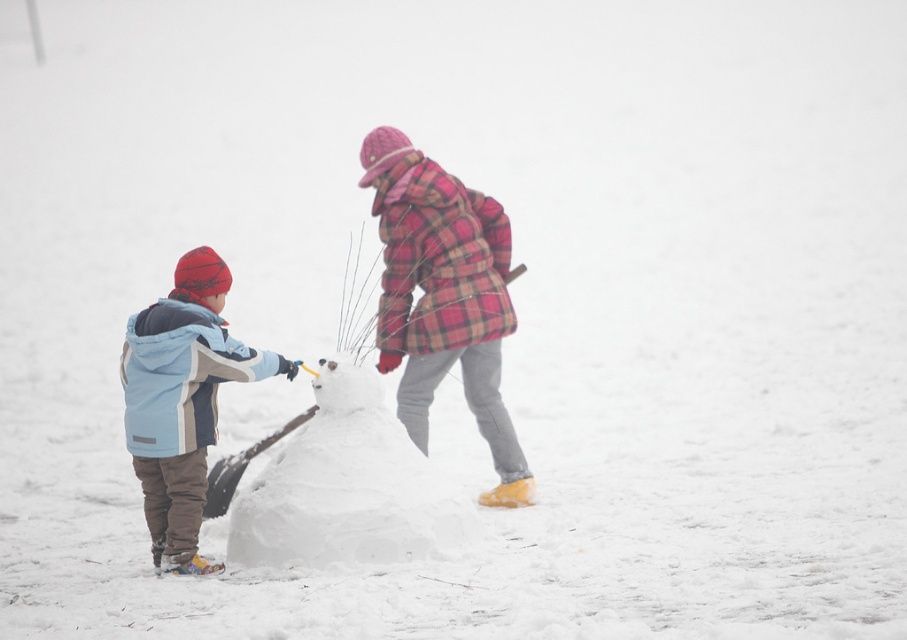
Question: Which object is positioned closest to the plaid fabric coat at center?

Choices:
 (A) light blue fleece jacket at left
 (B) white fluffy snowman at center

Answer: (B)

Question: Which point is closer to the camera?

Choices:
 (A) plaid fabric coat at center
 (B) light blue fleece jacket at left

Answer: (B)

Question: Can you confirm if white fluffy snowman at center is bigger than light blue fleece jacket at left?

Choices:
 (A) no
 (B) yes

Answer: (B)

Question: Can you confirm if white fluffy snowman at center is positioned to the left of light blue fleece jacket at left?

Choices:
 (A) yes
 (B) no

Answer: (B)

Question: Which of the following is the closest to the observer?

Choices:
 (A) (451, 227)
 (B) (221, 378)

Answer: (B)

Question: From the image, what is the correct spatial relationship of white fluffy snowman at center in relation to light blue fleece jacket at left?

Choices:
 (A) left
 (B) right

Answer: (B)